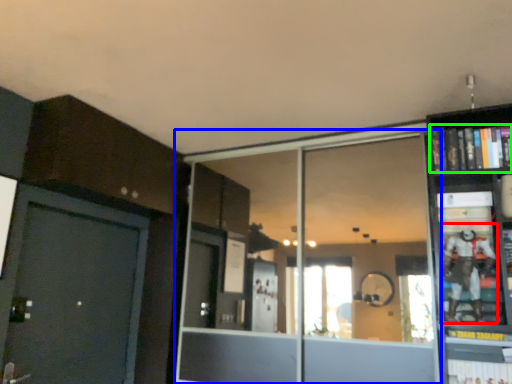
Question: Based on their relative distances, which object is nearer to toy (highlighted by a red box)? Choose from glass door (highlighted by a blue box) and book (highlighted by a green box).

Choices:
 (A) glass door
 (B) book

Answer: (B)